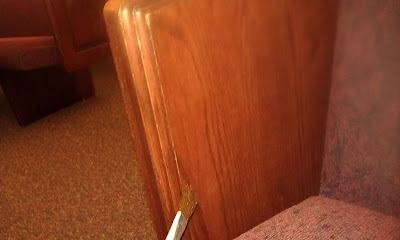
Locate an element on the screen. The width and height of the screenshot is (400, 240). seat cushion is located at coordinates (41, 56).